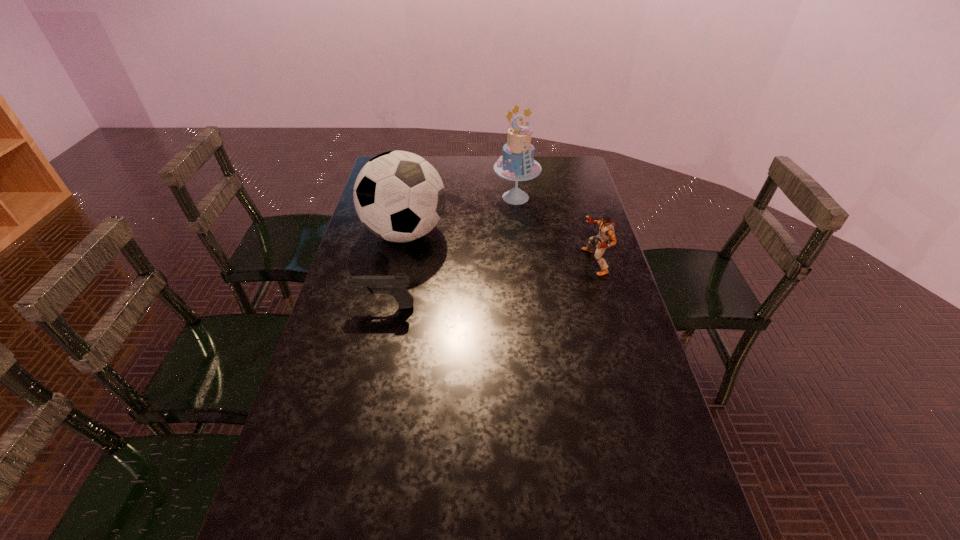
Identify the location of free space on the desktop that is between the shortest object and the puncher and is positioned with a ladder on the side of the cake. (514, 279).

At what (x,y) coordinates should I click in order to perform the action: click on vacant space on the desktop that is between the nearest object and the puncher and is positioned on the main logo of the soccer ball. Please return your answer as a coordinate pair (x, y). This screenshot has width=960, height=540. Looking at the image, I should click on (482, 286).